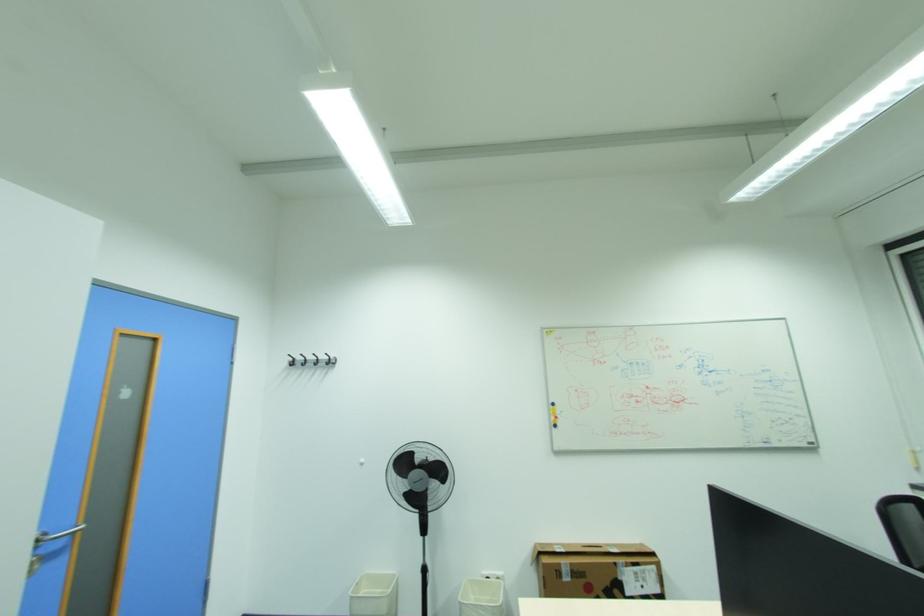
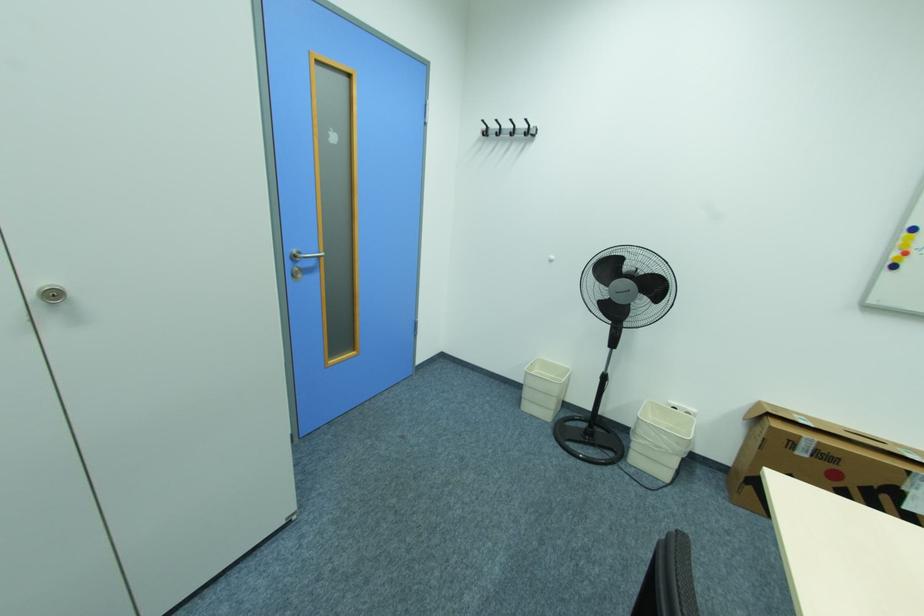
In the second image, find the point that corresponds to the point at 565,564 in the first image.

(805, 437)